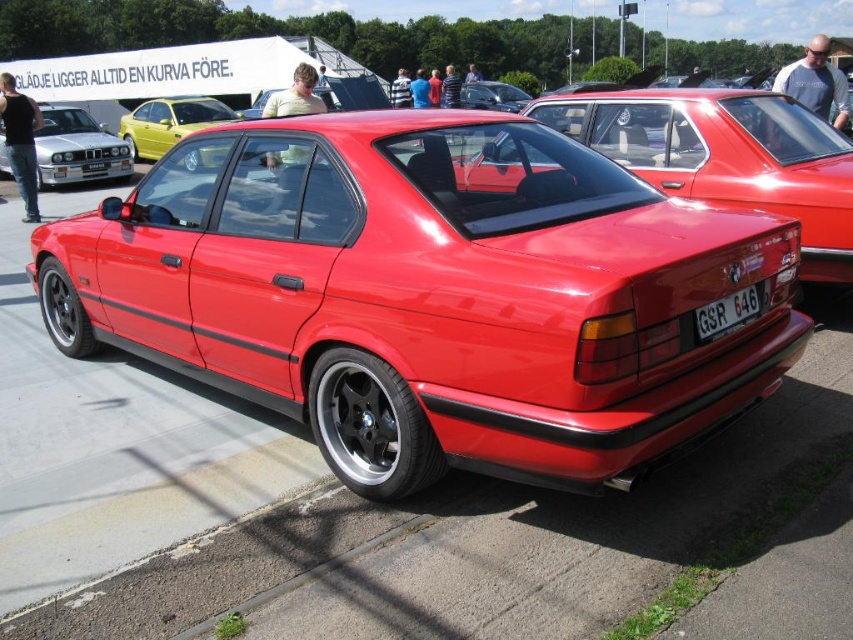
Question: Is metallic yellow car at upper left to the left of white plastic license plate at rear from the viewer's perspective?

Choices:
 (A) no
 (B) yes

Answer: (B)

Question: Is the position of glossy red car at center more distant than that of metallic yellow car at upper left?

Choices:
 (A) yes
 (B) no

Answer: (B)

Question: Which of the following is the closest to the observer?

Choices:
 (A) (54, 131)
 (B) (740, 308)
 (C) (216, 99)

Answer: (B)

Question: In this image, where is glossy red car at center located relative to matte silver car at left?

Choices:
 (A) below
 (B) above

Answer: (A)

Question: Which point is farther to the camera?

Choices:
 (A) (743, 300)
 (B) (729, 195)

Answer: (B)

Question: Which point is closer to the camera taking this photo?

Choices:
 (A) (x=119, y=161)
 (B) (x=688, y=195)

Answer: (B)